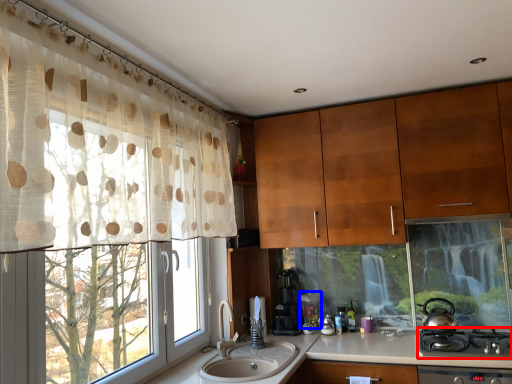
Question: Among these objects, which one is farthest to the camera, gas stove (highlighted by a red box) or appliance (highlighted by a blue box)?

Choices:
 (A) gas stove
 (B) appliance

Answer: (B)